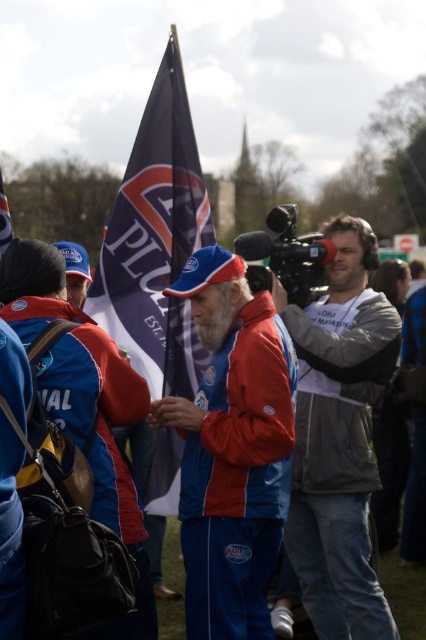
Question: Estimate the real-world distances between objects in this image. Which object is closer to the blue fabric santa claus at center?

Choices:
 (A) blue fabric flag at upper center
 (B) red jacket at center

Answer: (B)

Question: Is red jacket at center to the right of blue fabric flag at upper center from the viewer's perspective?

Choices:
 (A) yes
 (B) no

Answer: (A)

Question: Which point is farther to the camera?

Choices:
 (A) (356, 269)
 (B) (13, 234)
 (C) (109, 227)

Answer: (B)

Question: Does blue fabric santa claus at center lie in front of blue fabric flag at center?

Choices:
 (A) no
 (B) yes

Answer: (B)

Question: Among these objects, which one is nearest to the camera?

Choices:
 (A) red jacket at center
 (B) blue fabric flag at center
 (C) blue fabric flag at upper center
 (D) blue fabric santa claus at center

Answer: (D)

Question: Is the position of red jacket at center more distant than that of blue fabric flag at center?

Choices:
 (A) no
 (B) yes

Answer: (A)